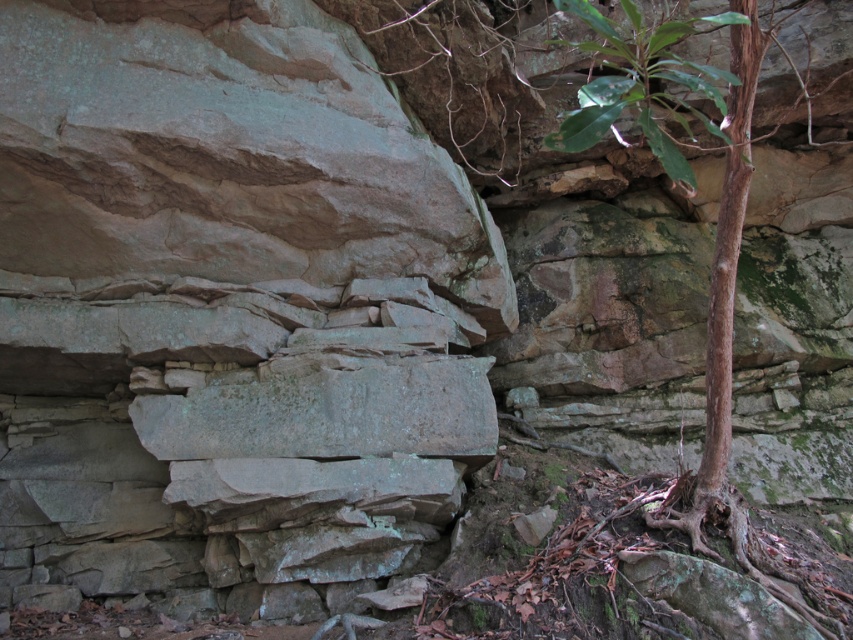
Question: Is gray stone wall at center positioned before green leafy plant at upper right?

Choices:
 (A) no
 (B) yes

Answer: (A)

Question: Is gray stone wall at center bigger than green leafy plant at upper right?

Choices:
 (A) yes
 (B) no

Answer: (A)

Question: Which point is closer to the camera taking this photo?

Choices:
 (A) (27, 136)
 (B) (556, 6)

Answer: (B)

Question: Is gray stone wall at center positioned behind green leafy plant at upper right?

Choices:
 (A) yes
 (B) no

Answer: (A)